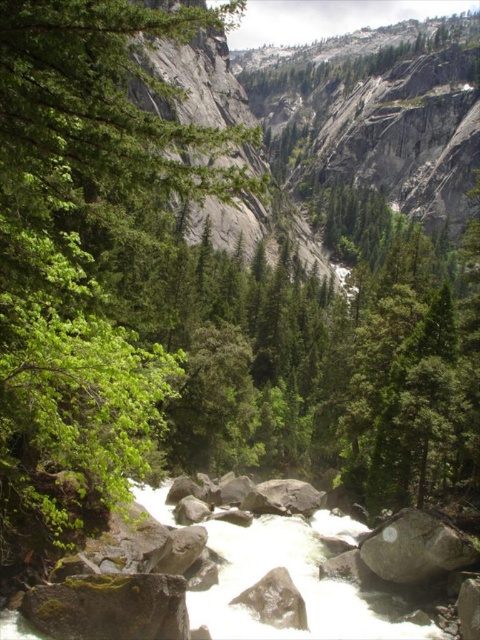
You are a hiker trying to cross the river using the gray rough boulder at center. There is a green leafy tree at left nearby. Which object is higher in elevation?

The green leafy tree at left is above the gray rough boulder at center, so the green leafy tree at left is higher in elevation.